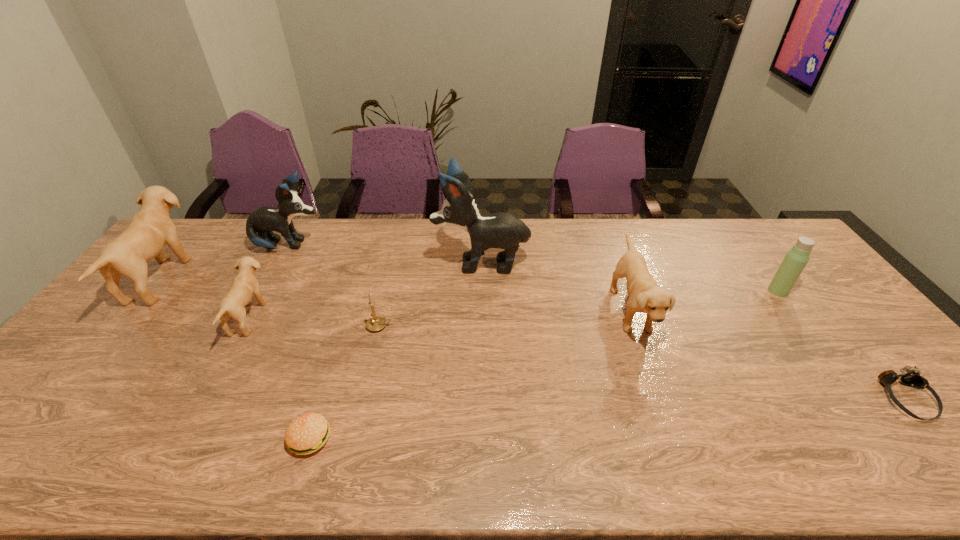
Where is `vacant space that is in between the fourth object from left to right and the goggles`? The image size is (960, 540). vacant space that is in between the fourth object from left to right and the goggles is located at coordinates (608, 418).

At what (x,y) coordinates should I click in order to perform the action: click on free space between the brown patty and the leftmost beige puppy. Please return your answer as a coordinate pair (x, y). The width and height of the screenshot is (960, 540). Looking at the image, I should click on (235, 359).

Where is `empty space that is in between the brown patty and the second biggest beige puppy`? empty space that is in between the brown patty and the second biggest beige puppy is located at coordinates (470, 374).

This screenshot has height=540, width=960. I want to click on unoccupied position between the shortest puppy and the third object from right to left, so click(x=440, y=314).

Where is `unoccupied position between the tallest puppy and the gold candle holder`? Image resolution: width=960 pixels, height=540 pixels. unoccupied position between the tallest puppy and the gold candle holder is located at coordinates (430, 294).

The image size is (960, 540). Identify the location of vacant area between the smaller black puppy and the rightmost object. (597, 322).

Locate an element on the screen. vacant space that's between the smaller black puppy and the tallest object is located at coordinates pyautogui.click(x=385, y=254).

I want to click on free space between the fourth object from left to right and the second beige puppy from left to right, so click(x=279, y=377).

Find the location of `free space between the second beige puppy from right to left and the leftmost beige puppy`. free space between the second beige puppy from right to left and the leftmost beige puppy is located at coordinates (204, 298).

This screenshot has width=960, height=540. In order to click on vacant area between the sixth object from left to right and the second smallest beige puppy in this screenshot , I will do `click(556, 286)`.